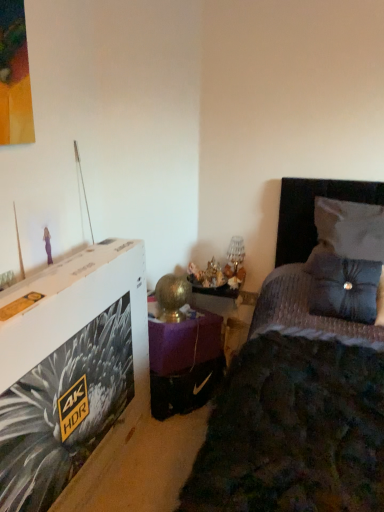
Question: Based on their positions, is satin blue pillow at right, which ranks as the 2th pillow in top-to-bottom order, located to the left or right of purple velvet table at center?

Choices:
 (A) right
 (B) left

Answer: (A)

Question: Is satin blue pillow at right, arranged as the 1th pillow when ordered from the bottom, inside the boundaries of purple velvet table at center, or outside?

Choices:
 (A) outside
 (B) inside

Answer: (A)

Question: Which object is positioned closest to the satin blue pillow at right, which ranks as the 2th pillow in top-to-bottom order?

Choices:
 (A) purple velvet table at center
 (B) white fabric pillow at upper right, arranged as the first pillow when viewed from the top
 (C) velvet dark blue bed at center

Answer: (B)

Question: Which object is positioned closest to the velvet dark blue bed at center?

Choices:
 (A) satin blue pillow at right, arranged as the 1th pillow when ordered from the bottom
 (B) white fabric pillow at upper right, arranged as the first pillow when viewed from the top
 (C) purple velvet table at center

Answer: (A)